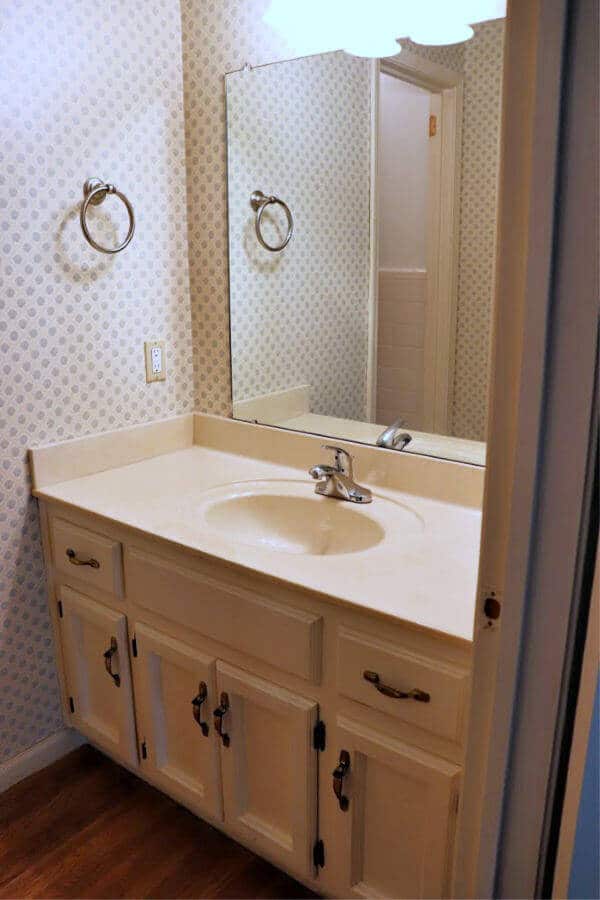
At what (x,y) coordinates should I click in order to perform the action: click on door frame. Please return your answer as a coordinate pair (x, y). The height and width of the screenshot is (900, 600). Looking at the image, I should click on (526, 542).